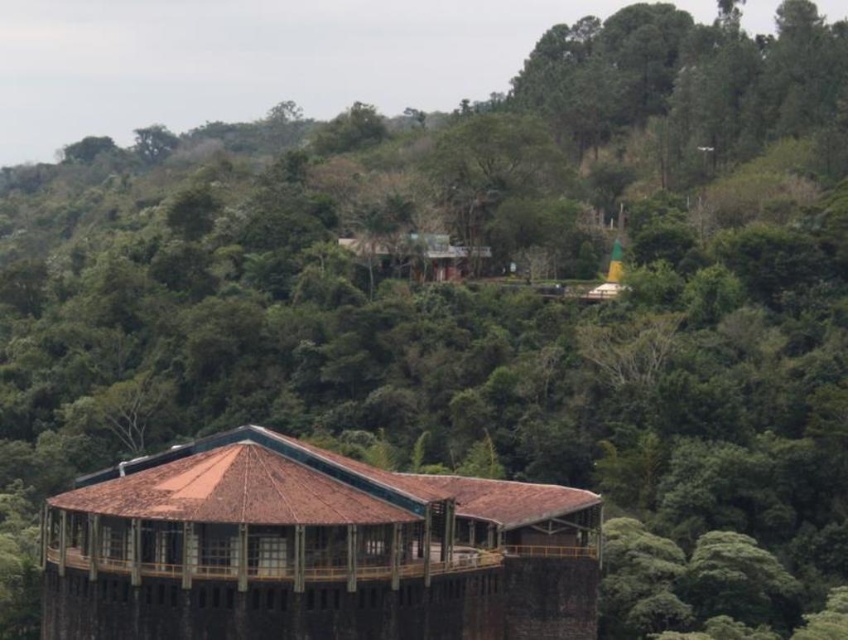
Question: Which point appears closest to the camera in this image?

Choices:
 (A) (562, 563)
 (B) (410, 234)

Answer: (A)

Question: Which point is farther to the camera?

Choices:
 (A) (434, 554)
 (B) (438, 268)

Answer: (B)

Question: Can you confirm if brown wooden gazebo at center is positioned to the left of brown wooden hut at center?

Choices:
 (A) yes
 (B) no

Answer: (A)

Question: Can you confirm if brown wooden gazebo at center is positioned below brown wooden hut at center?

Choices:
 (A) yes
 (B) no

Answer: (A)

Question: Which point is closer to the camera?

Choices:
 (A) brown wooden hut at center
 (B) brown wooden gazebo at center

Answer: (B)

Question: Can you confirm if brown wooden gazebo at center is positioned above brown wooden hut at center?

Choices:
 (A) yes
 (B) no

Answer: (B)